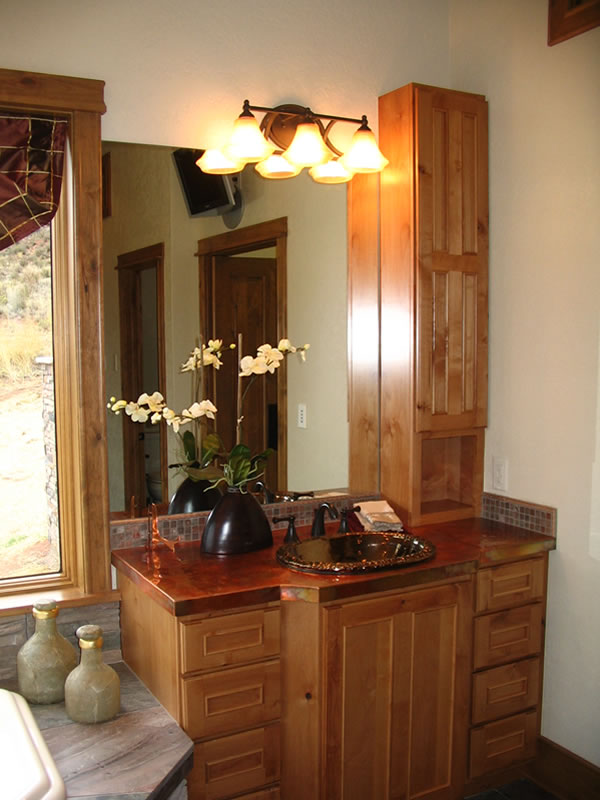
Identify the location of mirror. (204, 276).